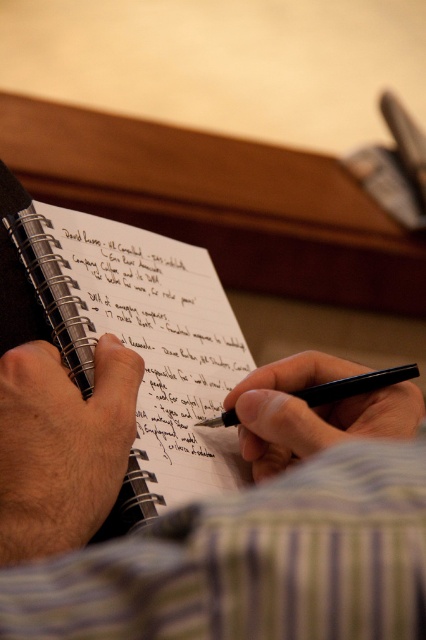
You are an artist trying to sketch the scene. You notice the striped fabric shirt at center and the smooth skin hand at center. Which object occupies more vertical space in the image?

The striped fabric shirt at center has a greater height compared to the smooth skin hand at center, so it occupies more vertical space.